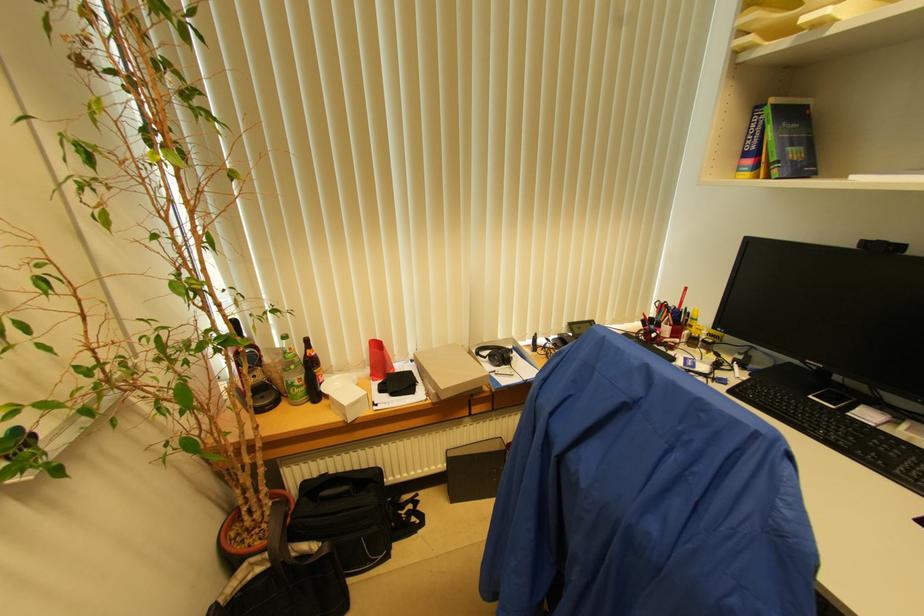
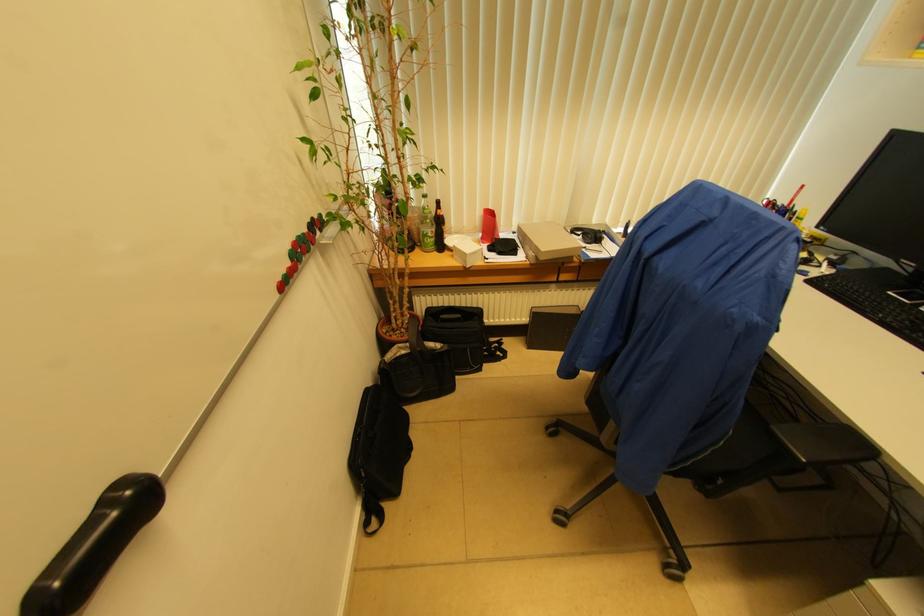
Question: How did the camera likely rotate?

Choices:
 (A) Left
 (B) Right
 (C) Up
 (D) Down

Answer: (D)